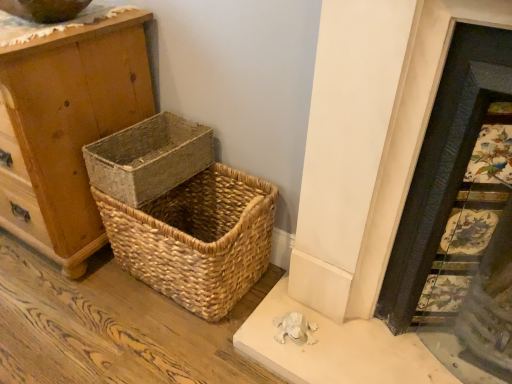
Question: Is the depth of decorative tile fireplace at right less than that of natural woven basket at center, which is the second picnic basket in bottom-to-top order?

Choices:
 (A) no
 (B) yes

Answer: (B)

Question: Does decorative tile fireplace at right have a smaller size compared to natural woven basket at center, which is the second picnic basket in bottom-to-top order?

Choices:
 (A) no
 (B) yes

Answer: (A)

Question: From a real-world perspective, does decorative tile fireplace at right sit lower than natural woven basket at center, the 1th picnic basket positioned from the top?

Choices:
 (A) no
 (B) yes

Answer: (A)

Question: Is decorative tile fireplace at right surrounding natural woven basket at center, the 1th picnic basket positioned from the top?

Choices:
 (A) yes
 (B) no

Answer: (B)

Question: From a real-world perspective, does decorative tile fireplace at right stand above natural woven basket at center, which is the second picnic basket in bottom-to-top order?

Choices:
 (A) yes
 (B) no

Answer: (A)

Question: In terms of size, does decorative tile fireplace at right appear bigger or smaller than natural woven basket at center, the 1th picnic basket positioned from the top?

Choices:
 (A) big
 (B) small

Answer: (A)

Question: Is point (456, 112) closer or farther from the camera than point (150, 163)?

Choices:
 (A) farther
 (B) closer

Answer: (B)

Question: From a real-world perspective, is decorative tile fireplace at right physically located above or below natural woven basket at center, the 1th picnic basket positioned from the top?

Choices:
 (A) below
 (B) above

Answer: (B)

Question: Relative to natural woven basket at center, the 1th picnic basket positioned from the top, is decorative tile fireplace at right in front or behind?

Choices:
 (A) behind
 (B) front

Answer: (B)

Question: From a real-world perspective, relative to natural woven basket at center, the 1th picnic basket positioned from the top, is natural woven picnic basket at lower left, the 2th picnic basket viewed from the top, vertically above or below?

Choices:
 (A) below
 (B) above

Answer: (A)

Question: Is natural woven picnic basket at lower left, the 2th picnic basket viewed from the top, spatially inside natural woven basket at center, the 1th picnic basket positioned from the top, or outside of it?

Choices:
 (A) outside
 (B) inside

Answer: (A)

Question: From the image's perspective, is natural woven picnic basket at lower left, the 2th picnic basket viewed from the top, located above or below natural woven basket at center, which is the second picnic basket in bottom-to-top order?

Choices:
 (A) below
 (B) above

Answer: (A)

Question: Considering the positions of natural woven picnic basket at lower left, the 2th picnic basket viewed from the top, and natural woven basket at center, which is the second picnic basket in bottom-to-top order, in the image, is natural woven picnic basket at lower left, the 2th picnic basket viewed from the top, taller or shorter than natural woven basket at center, which is the second picnic basket in bottom-to-top order,?

Choices:
 (A) tall
 (B) short

Answer: (A)

Question: In the image, is decorative tile fireplace at right on the left side or the right side of wooden chest of drawers at left?

Choices:
 (A) left
 (B) right

Answer: (B)

Question: Is decorative tile fireplace at right inside or outside of wooden chest of drawers at left?

Choices:
 (A) inside
 (B) outside

Answer: (B)